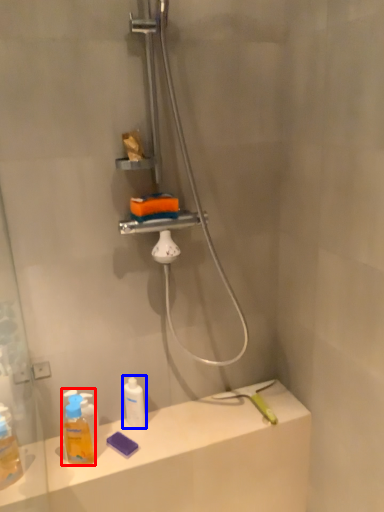
Question: Among these objects, which one is farthest to the camera, mouthwash (highlighted by a red box) or mouthwash (highlighted by a blue box)?

Choices:
 (A) mouthwash
 (B) mouthwash

Answer: (B)